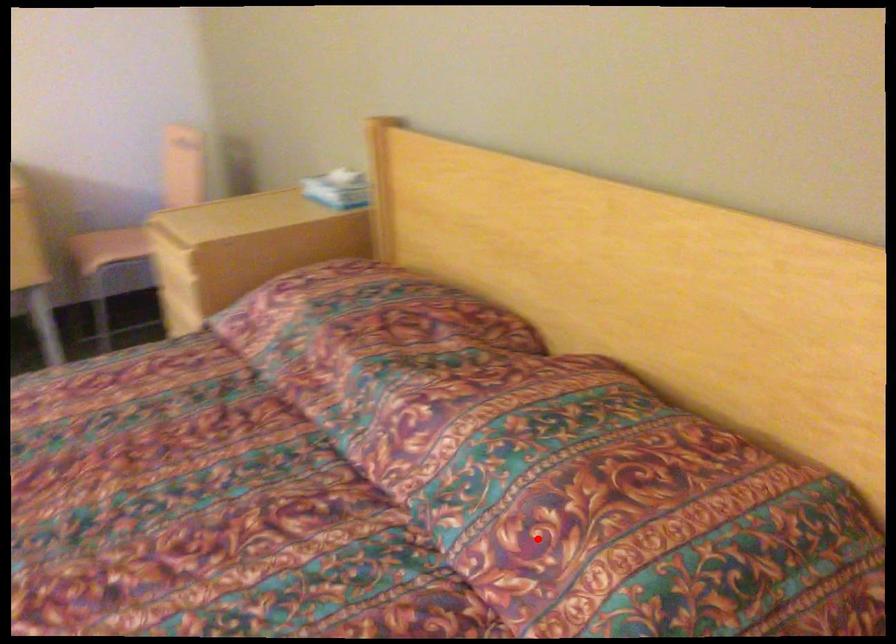
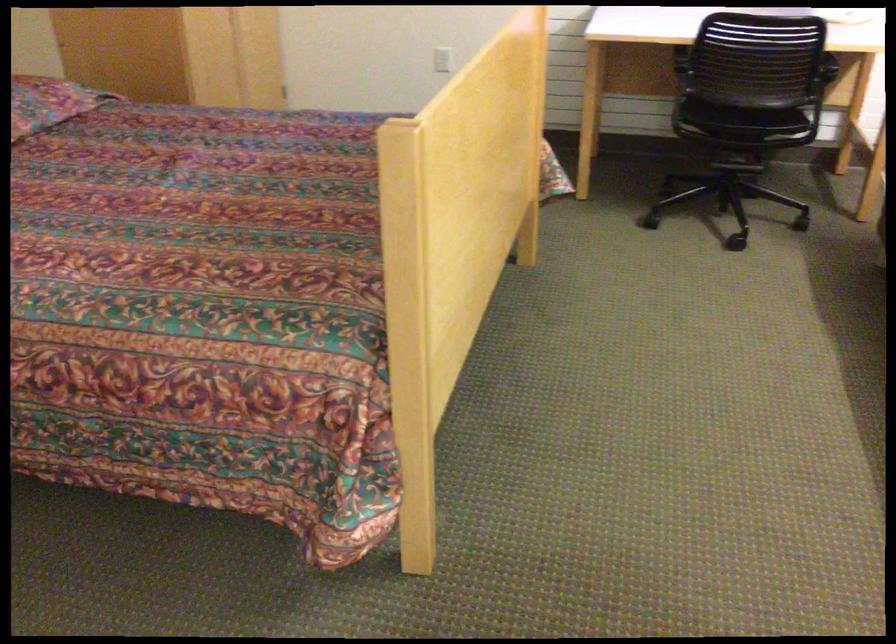
Where in the second image is the point corresponding to the highlighted location from the first image?

(48, 102)